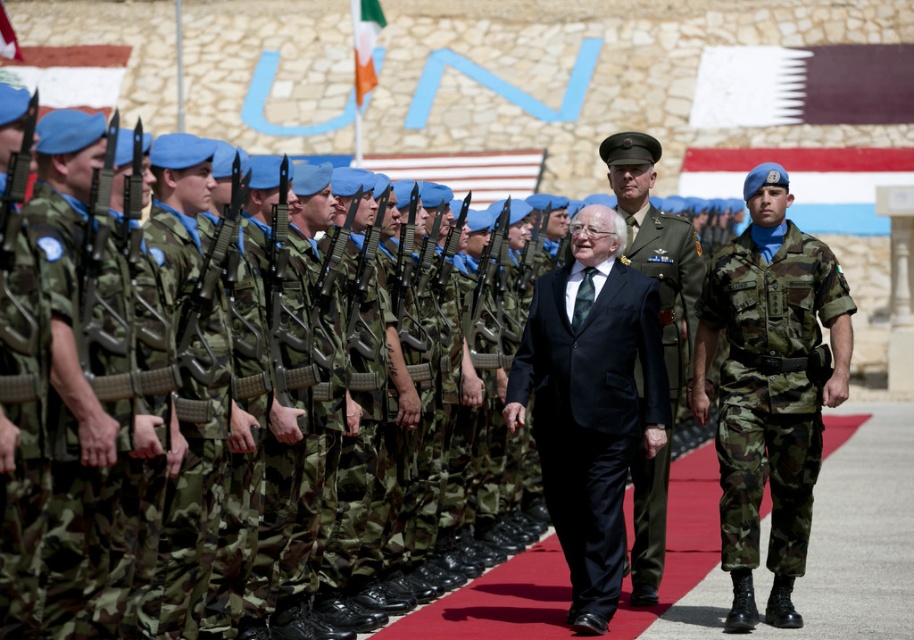
You are a photographer at the military ceremony. You need to capture a photo where both the camo fabric uniform at right and the green uniform at center are clearly visible. Based on their positions, which uniform should you focus on first to ensure both are in frame?

The camo fabric uniform at right is in front of the green uniform at center, so you should focus on the green uniform at center first to ensure both are in frame.

You are a photographer at the ceremony. You need to capture a photo where both the black velvet suit at center and the green uniform at center are visible. Which subject should you adjust your camera settings to focus on first to ensure proper exposure, considering their sizes?

The black velvet suit at center is narrower than the green uniform at center, so you should focus on the green uniform at center first to ensure proper exposure due to its larger size.

You are a photographer standing at the camera position. You want to take a closeup photo of the black velvet suit at center. Can you estimate how far you need to move forward to get the subject to fill the frame?

The black velvet suit at center is 33.87 meters from the camera. To get a closeup, you would need to move closer, but the exact distance adjustment depends on the camera lens and sensor size. However, based on the given distance, you would need to move significantly closer to fill the frame.